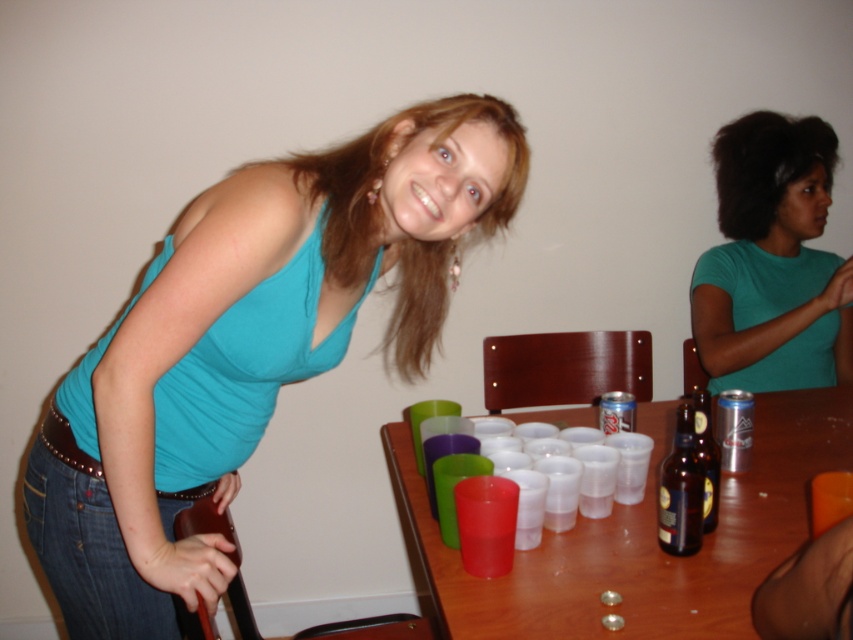
Question: Which object is farther from the camera taking this photo?

Choices:
 (A) teal fabric tank top at upper left
 (B) green matte shirt at upper right
 (C) brown glass bottle at lower right

Answer: (B)

Question: Does teal fabric tank top at upper left appear under brown glass bottle at lower right?

Choices:
 (A) no
 (B) yes

Answer: (A)

Question: Which point appears farthest from the camera in this image?

Choices:
 (A) (808, 420)
 (B) (712, 461)
 (C) (370, 282)
 (D) (795, 237)

Answer: (D)

Question: Is translucent plastic cups at center below brown glass bottle at table right?

Choices:
 (A) yes
 (B) no

Answer: (A)

Question: Which point appears closest to the camera in this image?

Choices:
 (A) (795, 259)
 (B) (706, 525)

Answer: (B)

Question: Is green matte shirt at upper right closer to the viewer compared to brown glass bottle at lower right?

Choices:
 (A) yes
 (B) no

Answer: (B)